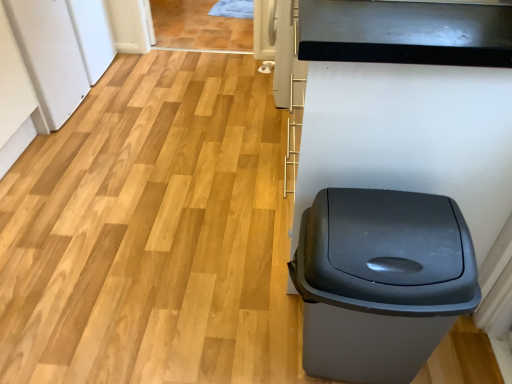
Question: Considering their positions, is white matte refrigerator at left located in front of or behind matte gray plastic trash can at right?

Choices:
 (A) behind
 (B) front

Answer: (A)

Question: From the image's perspective, is white matte refrigerator at left above or below matte gray plastic trash can at right?

Choices:
 (A) above
 (B) below

Answer: (A)

Question: Considering the positions of white matte refrigerator at left and matte gray plastic trash can at right in the image, is white matte refrigerator at left taller or shorter than matte gray plastic trash can at right?

Choices:
 (A) short
 (B) tall

Answer: (B)

Question: In terms of height, does matte gray plastic trash can at right look taller or shorter compared to white matte refrigerator at left?

Choices:
 (A) tall
 (B) short

Answer: (B)

Question: Based on their positions, is matte gray plastic trash can at right located to the left or right of white matte refrigerator at left?

Choices:
 (A) left
 (B) right

Answer: (B)

Question: From the image's perspective, relative to white matte refrigerator at left, is matte gray plastic trash can at right above or below?

Choices:
 (A) below
 (B) above

Answer: (A)

Question: In the image, is matte gray plastic trash can at right positioned in front of or behind white matte refrigerator at left?

Choices:
 (A) front
 (B) behind

Answer: (A)